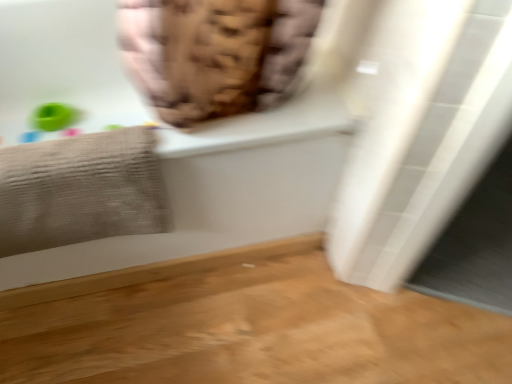
Question: Could you tell me if gray textured towel at left is facing white glossy bathtub at upper center?

Choices:
 (A) yes
 (B) no

Answer: (A)

Question: Is the position of gray textured towel at left less distant than that of white glossy bathtub at upper center?

Choices:
 (A) no
 (B) yes

Answer: (A)

Question: Is gray textured towel at left wider than white glossy bathtub at upper center?

Choices:
 (A) yes
 (B) no

Answer: (B)

Question: Is gray textured towel at left positioned far away from white glossy bathtub at upper center?

Choices:
 (A) no
 (B) yes

Answer: (A)

Question: From a real-world perspective, is gray textured towel at left positioned under white glossy bathtub at upper center based on gravity?

Choices:
 (A) no
 (B) yes

Answer: (A)

Question: From the image's perspective, is gray textured towel at left beneath white glossy bathtub at upper center?

Choices:
 (A) no
 (B) yes

Answer: (B)

Question: Are white glossy bathtub at upper center and gray textured towel at left making contact?

Choices:
 (A) yes
 (B) no

Answer: (B)

Question: Can you confirm if white glossy bathtub at upper center is taller than gray textured towel at left?

Choices:
 (A) yes
 (B) no

Answer: (A)

Question: Is white glossy bathtub at upper center shorter than gray textured towel at left?

Choices:
 (A) no
 (B) yes

Answer: (A)

Question: Is white glossy bathtub at upper center looking in the opposite direction of gray textured towel at left?

Choices:
 (A) no
 (B) yes

Answer: (B)

Question: Is white glossy bathtub at upper center positioned far away from gray textured towel at left?

Choices:
 (A) no
 (B) yes

Answer: (A)

Question: Considering the relative sizes of white glossy bathtub at upper center and gray textured towel at left in the image provided, is white glossy bathtub at upper center bigger than gray textured towel at left?

Choices:
 (A) yes
 (B) no

Answer: (A)

Question: Visually, is gray textured towel at left positioned to the left or to the right of white glossy bathtub at upper center?

Choices:
 (A) left
 (B) right

Answer: (A)